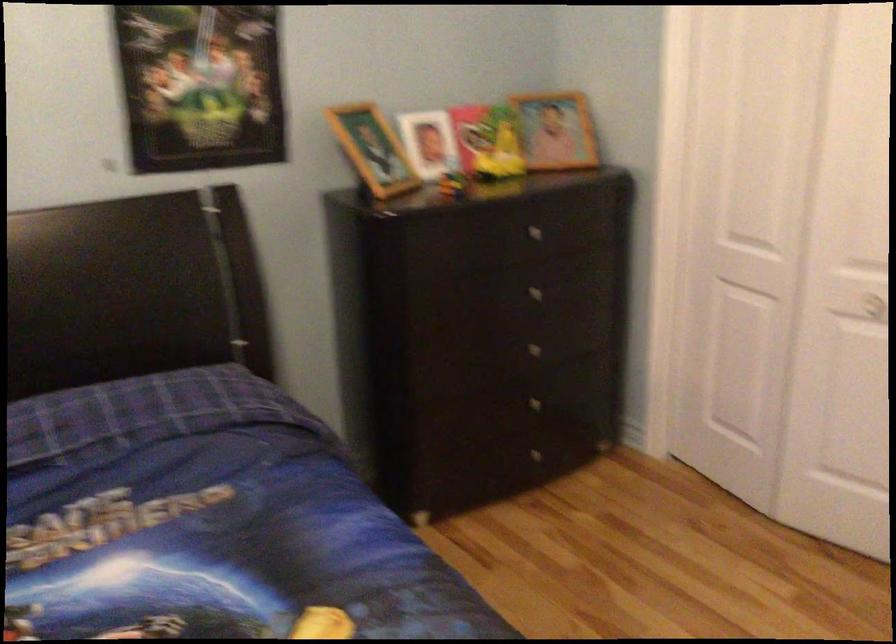
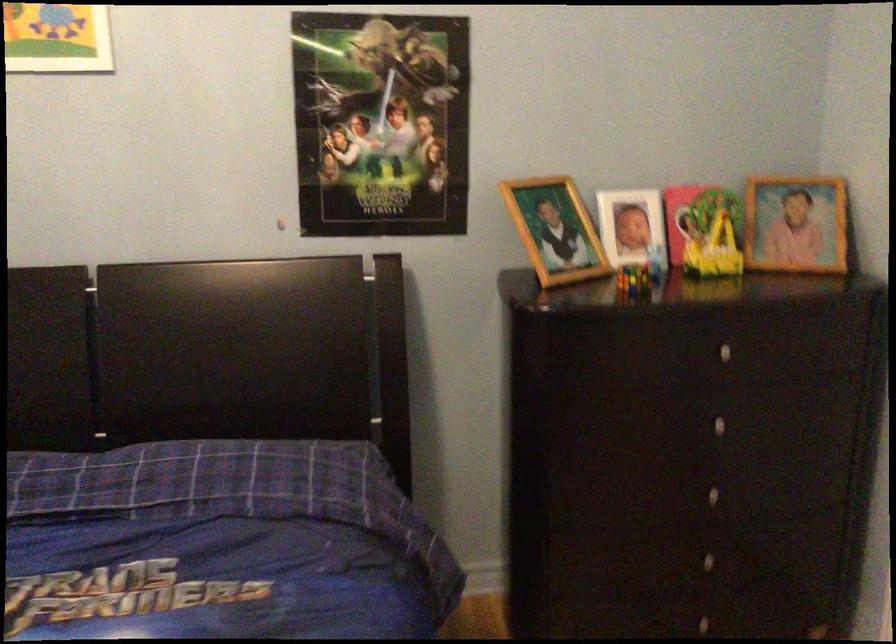
Where in the second image is the point corresponding to point (373, 147) from the first image?

(555, 230)